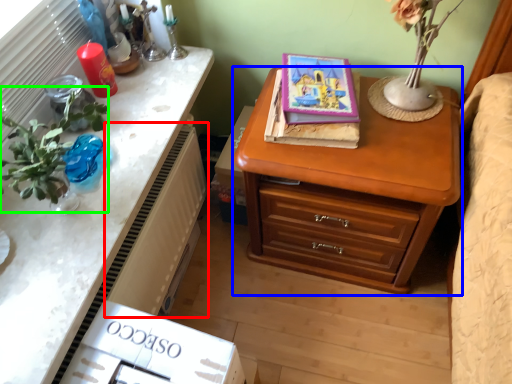
Question: Estimate the real-world distances between objects in this image. Which object is farther from radiator (highlighted by a red box), chest of drawers (highlighted by a blue box) or floral arrangement (highlighted by a green box)?

Choices:
 (A) chest of drawers
 (B) floral arrangement

Answer: (A)